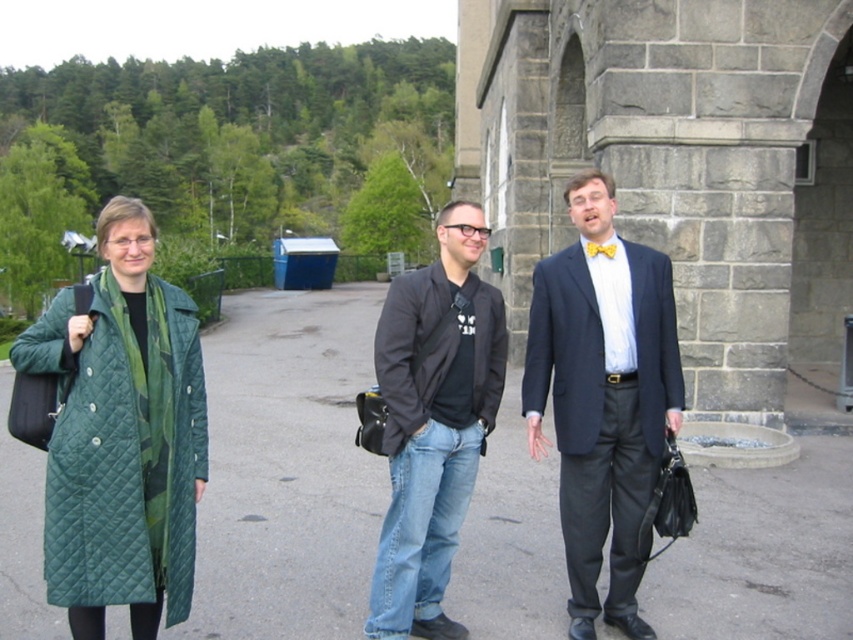
Question: Among these points, which one is nearest to the camera?

Choices:
 (A) (381, 436)
 (B) (585, 600)
 (C) (570, 627)
 (D) (612, 257)

Answer: (A)

Question: Which point appears farthest from the camera in this image?

Choices:
 (A) (552, 259)
 (B) (622, 504)
 (C) (492, 371)
 (D) (53, 532)

Answer: (A)

Question: Does green quilted coat at left have a lesser width compared to yellow satin bow tie at center?

Choices:
 (A) no
 (B) yes

Answer: (A)

Question: Is matte black jacket at center closer to camera compared to black quilted jacket at center?

Choices:
 (A) no
 (B) yes

Answer: (A)

Question: Which of these objects is positioned closest to the black cotton jacket at center?

Choices:
 (A) matte black jacket at center
 (B) yellow satin bow tie at center
 (C) matte black suit at center

Answer: (C)

Question: Can you confirm if matte black suit at center is positioned to the right of black quilted jacket at center?

Choices:
 (A) no
 (B) yes

Answer: (B)